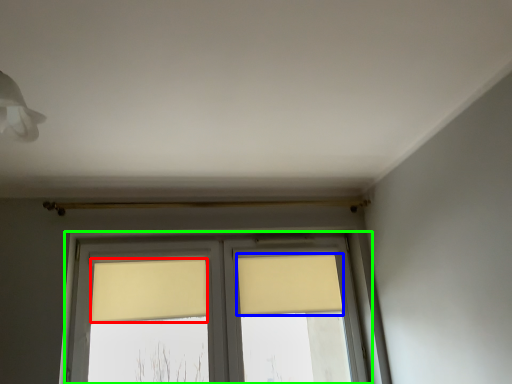
Question: Which object is the farthest from curtain (highlighted by a red box)? Choose among these: curtain (highlighted by a blue box) or window (highlighted by a green box).

Choices:
 (A) curtain
 (B) window

Answer: (A)